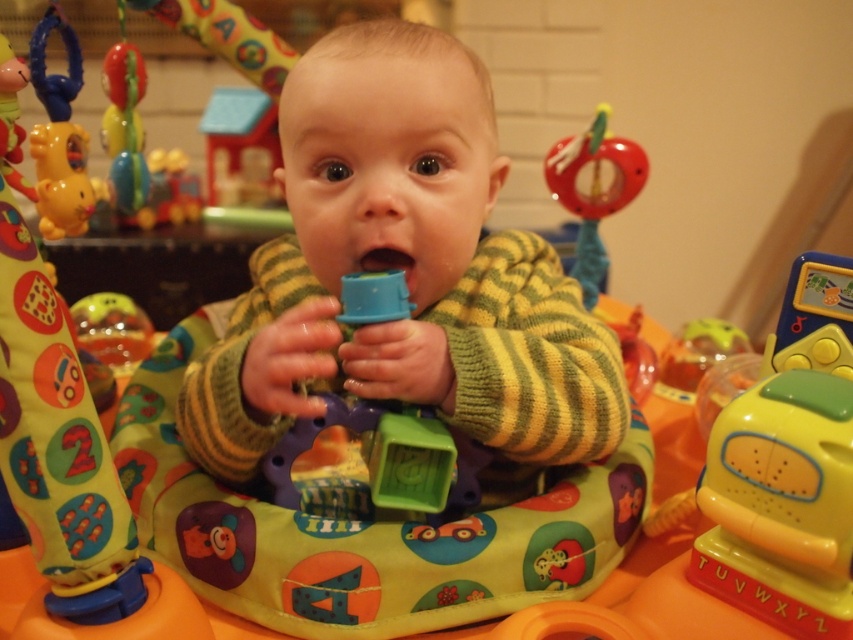
You are a parent holding a baby toy. The toy is at point (314, 426). You want to hand it to your baby who is in the bouncer. Is the toy within reach of the baby?

The point (314, 426) is 24.91 inches away from the viewer. Assuming the baby can reach up to 24 inches, the toy is slightly out of reach.

You are a photographer trying to capture a photo of the baby in the bouncer. You notice two points marked in the scene. The first point is at coordinate point (126, 332) and the second is at point (379, 257). To ensure both points are in focus, which point should you focus on first to capture both clearly?

Since point (126, 332) is behind point (379, 257), you should focus on point (379, 257) first to ensure both are in focus.

You are a parent trying to give your baby a drink. You see the blue plastic cup at center and the translucent plastic cup at center. Which cup is larger and better suited for holding more liquid?

The blue plastic cup at center is bigger than the translucent plastic cup at center, so it is better suited for holding more liquid.